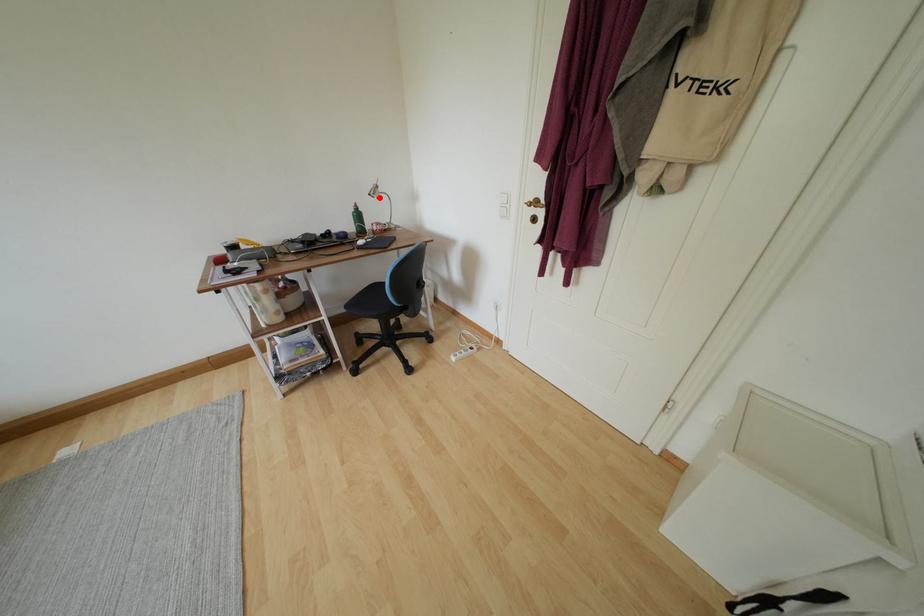
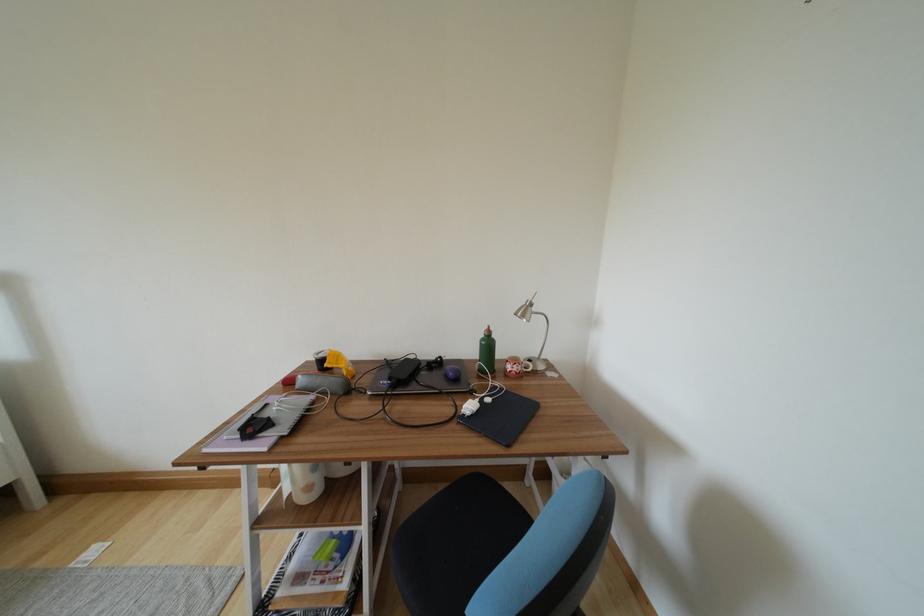
Where in the second image is the point corresponding to the highlighted location from the first image?

(528, 320)